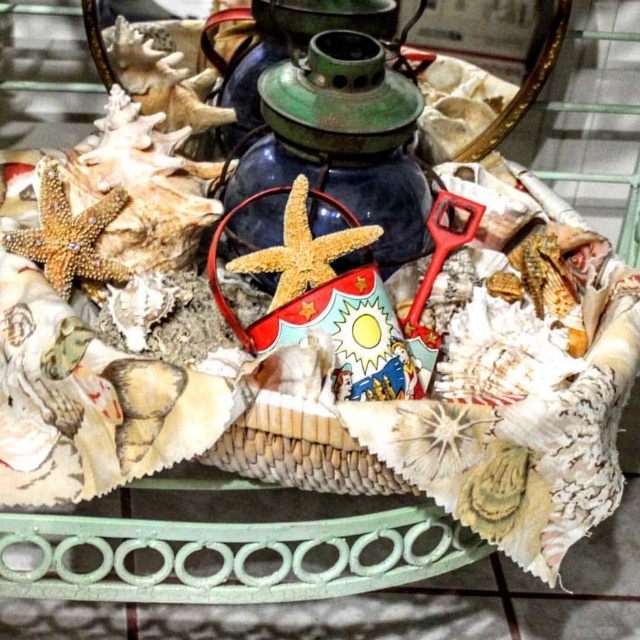
The height and width of the screenshot is (640, 640). Describe the element at coordinates (323, 300) in the screenshot. I see `matte wicker basket at center` at that location.

Is point (330, 424) farther from viewer compared to point (241, 173)?

That is False.

This screenshot has height=640, width=640. I want to click on matte wicker basket at center, so click(x=323, y=300).